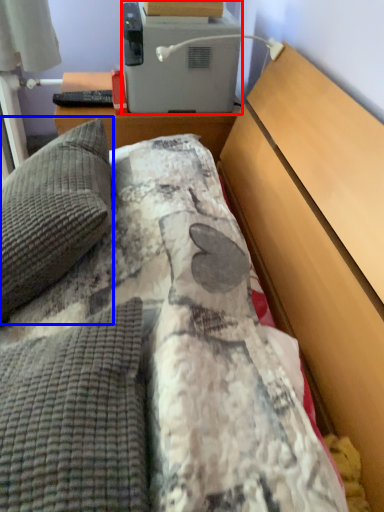
Question: Which of the following is the farthest to the observer, appliance (highlighted by a red box) or pillow (highlighted by a blue box)?

Choices:
 (A) appliance
 (B) pillow

Answer: (A)